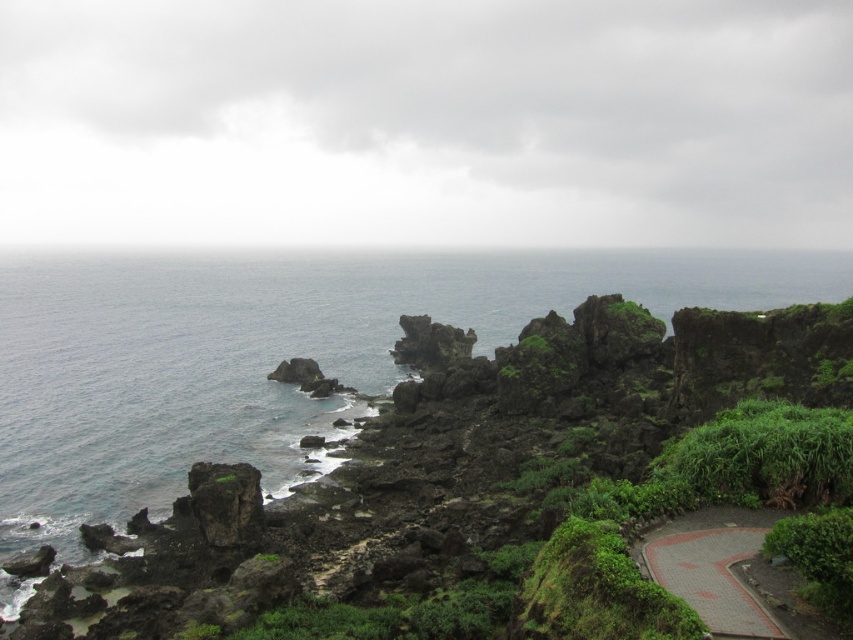
Question: Where is blue water at center located in relation to paved brick path at lower right in the image?

Choices:
 (A) above
 (B) below

Answer: (A)

Question: Which point is farther to the camera?

Choices:
 (A) paved brick path at lower right
 (B) blue water at center

Answer: (B)

Question: Which point is closer to the camera?

Choices:
 (A) blue water at center
 (B) paved brick path at lower right

Answer: (B)

Question: Can you confirm if blue water at center is positioned to the left of paved brick path at lower right?

Choices:
 (A) yes
 (B) no

Answer: (A)

Question: Is blue water at center wider than paved brick path at lower right?

Choices:
 (A) no
 (B) yes

Answer: (B)